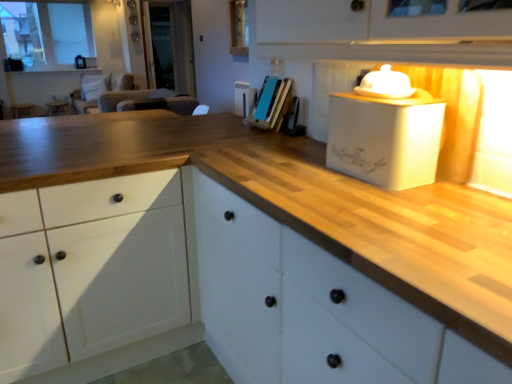
Question: Is white matte box at upper right, which appears as the 1th appliance when ordered from the bottom, smaller than white ceramic lid at upper right, the 2th appliance ordered from the bottom?

Choices:
 (A) no
 (B) yes

Answer: (A)

Question: Can you confirm if white matte box at upper right, which appears as the 1th appliance when ordered from the bottom, is shorter than white ceramic lid at upper right, the 2th appliance ordered from the bottom?

Choices:
 (A) yes
 (B) no

Answer: (B)

Question: From a real-world perspective, does white matte box at upper right, which appears as the 1th appliance when ordered from the bottom, stand above white ceramic lid at upper right, the 1th appliance when ordered from top to bottom?

Choices:
 (A) no
 (B) yes

Answer: (A)

Question: Is white matte box at upper right, which ranks as the second appliance in top-to-bottom order, looking in the opposite direction of white ceramic lid at upper right, the 2th appliance ordered from the bottom?

Choices:
 (A) yes
 (B) no

Answer: (B)

Question: Is the surface of white matte box at upper right, which appears as the 1th appliance when ordered from the bottom, in direct contact with white ceramic lid at upper right, the 2th appliance ordered from the bottom?

Choices:
 (A) yes
 (B) no

Answer: (B)

Question: Is white glass window at upper left taller or shorter than white ceramic lid at upper right, the 2th appliance ordered from the bottom?

Choices:
 (A) tall
 (B) short

Answer: (A)

Question: Relative to white ceramic lid at upper right, the 2th appliance ordered from the bottom, is white glass window at upper left in front or behind?

Choices:
 (A) behind
 (B) front

Answer: (A)

Question: From the image's perspective, is white glass window at upper left located above or below white ceramic lid at upper right, the 2th appliance ordered from the bottom?

Choices:
 (A) above
 (B) below

Answer: (A)

Question: In the image, is white glass window at upper left on the left side or the right side of white ceramic lid at upper right, the 1th appliance when ordered from top to bottom?

Choices:
 (A) left
 (B) right

Answer: (A)

Question: In terms of height, does white wood cabinet at center look taller or shorter compared to white glass window at upper left?

Choices:
 (A) tall
 (B) short

Answer: (B)

Question: Considering the positions of white wood cabinet at center and white glass window at upper left in the image, is white wood cabinet at center wider or thinner than white glass window at upper left?

Choices:
 (A) wide
 (B) thin

Answer: (A)

Question: In terms of size, does white wood cabinet at center appear bigger or smaller than white glass window at upper left?

Choices:
 (A) small
 (B) big

Answer: (B)

Question: Considering the relative positions of white wood cabinet at center and white glass window at upper left in the image provided, is white wood cabinet at center to the left or to the right of white glass window at upper left?

Choices:
 (A) right
 (B) left

Answer: (A)

Question: In the image, is white glass window at upper left on the left side or the right side of blue matte book at center?

Choices:
 (A) left
 (B) right

Answer: (A)

Question: In the image, is white glass window at upper left positioned in front of or behind blue matte book at center?

Choices:
 (A) front
 (B) behind

Answer: (B)